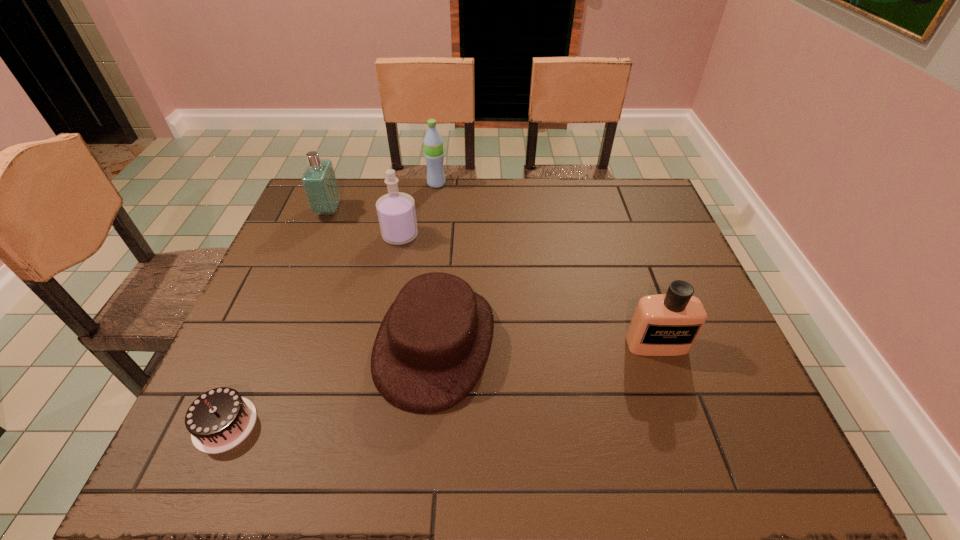
In order to click on vacant position located 0.050m on the front of the second nearest perfume in this screenshot , I will do `click(396, 260)`.

Locate an element on the screen. The height and width of the screenshot is (540, 960). vacant position located 0.170m on the front label of the fifth nearest object is located at coordinates (395, 211).

This screenshot has width=960, height=540. I want to click on free spot located on the front label of the rightmost perfume, so click(x=680, y=410).

Where is `vacant space located 0.230m on the right of the second shortest object`? This screenshot has width=960, height=540. vacant space located 0.230m on the right of the second shortest object is located at coordinates (x=594, y=343).

At what (x,y) coordinates should I click in order to perform the action: click on vacant area situated on the right of the chocolate cake. Please return your answer as a coordinate pair (x, y). Image resolution: width=960 pixels, height=540 pixels. Looking at the image, I should click on click(x=285, y=424).

Where is `water bottle that is at the far edge`? The height and width of the screenshot is (540, 960). water bottle that is at the far edge is located at coordinates (433, 143).

Locate an element on the screen. Image resolution: width=960 pixels, height=540 pixels. perfume that is positioned at the far edge is located at coordinates (319, 182).

Where is `object situated at the near edge`? object situated at the near edge is located at coordinates (218, 420).

This screenshot has height=540, width=960. In order to click on perfume present at the left edge in this screenshot , I will do `click(319, 182)`.

Find the location of a particular element. This screenshot has height=540, width=960. chocolate cake that is at the left edge is located at coordinates (218, 420).